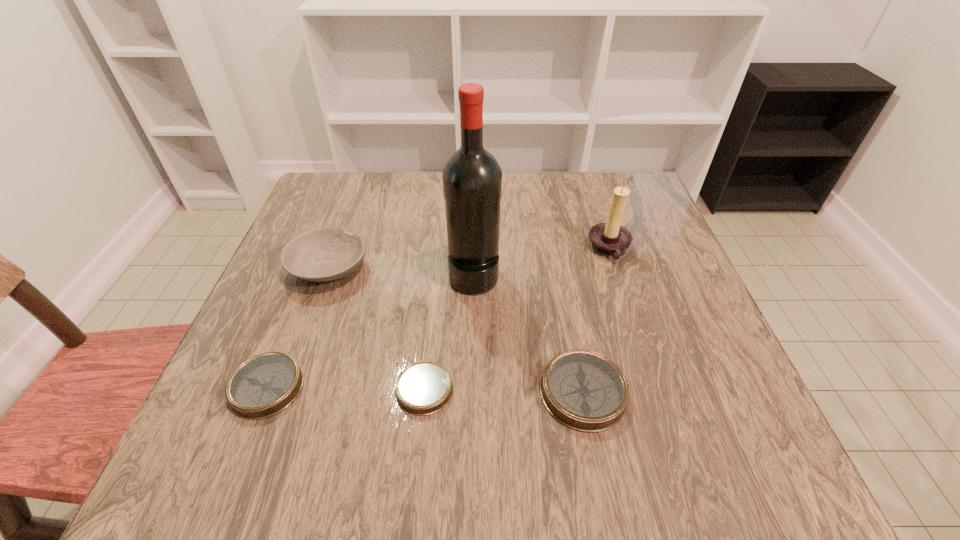
Identify the location of object that is at the right edge. Image resolution: width=960 pixels, height=540 pixels. (610, 239).

Where is `object positioned at the near left corner`? This screenshot has height=540, width=960. object positioned at the near left corner is located at coordinates (264, 385).

You are a GUI agent. You are given a task and a screenshot of the screen. Output one action in this format:
    pyautogui.click(x=<x>, y=<y>)
    Task: Click on the blank space at the far edge of the desktop
    The image size is (960, 540).
    Given the screenshot: What is the action you would take?
    pyautogui.click(x=558, y=199)

The height and width of the screenshot is (540, 960). Identify the location of vacant space at the near edge of the desktop. (393, 416).

Find the location of a particular element. The width and height of the screenshot is (960, 540). vacant space at the left edge of the desktop is located at coordinates (290, 312).

At what (x,y) coordinates should I click in order to perform the action: click on free point at the right edge. Please return your answer as a coordinate pair (x, y). Looking at the image, I should click on (667, 369).

The image size is (960, 540). In the image, there is a desktop. What are the coordinates of `vacant space at the far left corner` in the screenshot? It's located at (352, 191).

I want to click on vacant space at the far right corner of the desktop, so click(626, 183).

Identify the location of free space at the near right corner of the desktop. The image size is (960, 540). (745, 392).

Where is `free space that is in between the rightmost compass and the shortest object`? free space that is in between the rightmost compass and the shortest object is located at coordinates (504, 391).